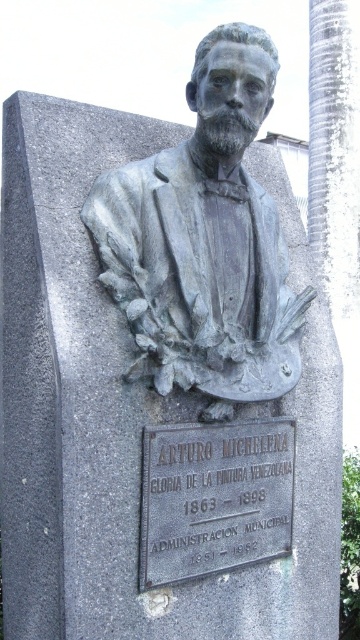
Is bronze bust at center to the left of black metal plaque at center from the viewer's perspective?

Correct, you'll find bronze bust at center to the left of black metal plaque at center.

Between point (213, 360) and point (290, 477), which one is positioned behind?

The point (290, 477) is behind.

Who is more forward, (285, 381) or (158, 534)?

Positioned in front is point (158, 534).

Image resolution: width=360 pixels, height=640 pixels. Identify the location of bronze bust at center. (204, 241).